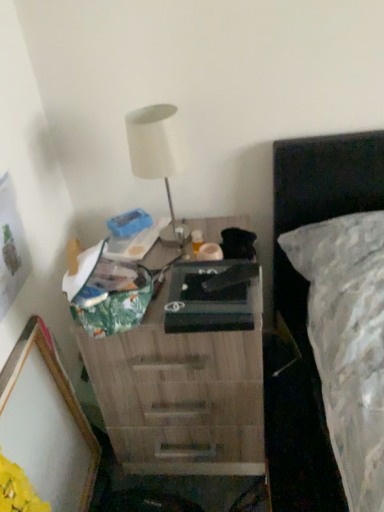
Question: Considering the positions of white matte table lamp at upper center and wooden nightstand at center in the image, is white matte table lamp at upper center taller or shorter than wooden nightstand at center?

Choices:
 (A) tall
 (B) short

Answer: (B)

Question: Relative to wooden nightstand at center, is white matte table lamp at upper center in front or behind?

Choices:
 (A) front
 (B) behind

Answer: (B)

Question: Considering the real-world distances, which object is farthest from the wooden nightstand at center?

Choices:
 (A) wooden picture frame at lower left
 (B) white matte table lamp at upper center

Answer: (B)

Question: Estimate the real-world distances between objects in this image. Which object is farther from the wooden picture frame at lower left?

Choices:
 (A) wooden nightstand at center
 (B) white matte table lamp at upper center

Answer: (B)